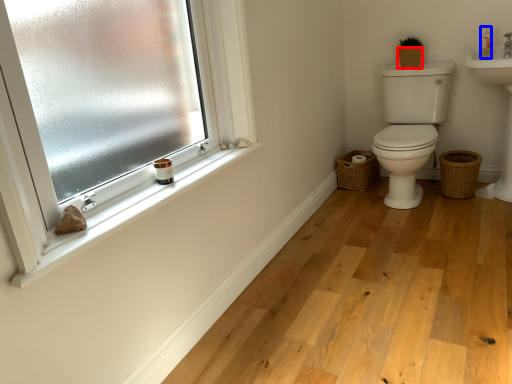
Question: Which of the following is the farthest to the observer, basket (highlighted by a red box) or toiletry (highlighted by a blue box)?

Choices:
 (A) basket
 (B) toiletry

Answer: (A)